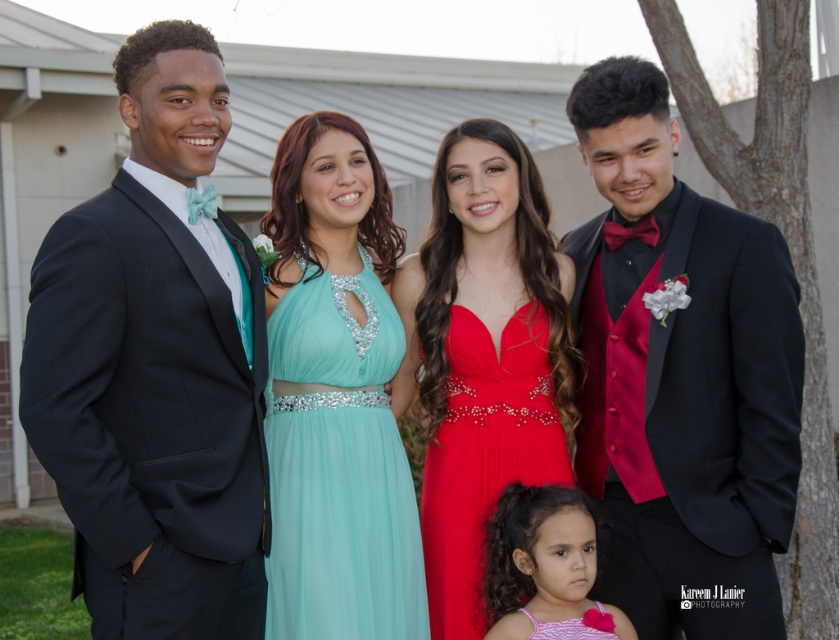
Question: Which object is the farthest from the matte black suit at left?

Choices:
 (A) tulle/aqua dress at center
 (B) shiny black suit at right

Answer: (B)

Question: Does shiny black suit at right have a smaller size compared to pink satin dress at lower center?

Choices:
 (A) no
 (B) yes

Answer: (A)

Question: Which point is farther to the camera?

Choices:
 (A) tulle/aqua dress at center
 (B) matte black suit at left
 (C) pink satin dress at lower center

Answer: (A)

Question: Which point is farther to the camera?

Choices:
 (A) tulle/aqua dress at center
 (B) pink satin dress at lower center
 (C) shiny black suit at right
 (D) matte black suit at left

Answer: (A)

Question: Can you confirm if tulle/aqua dress at center is positioned to the left of shiny satin dress at center?

Choices:
 (A) yes
 (B) no

Answer: (A)

Question: Is shiny satin dress at center further to camera compared to pink satin dress at lower center?

Choices:
 (A) no
 (B) yes

Answer: (B)